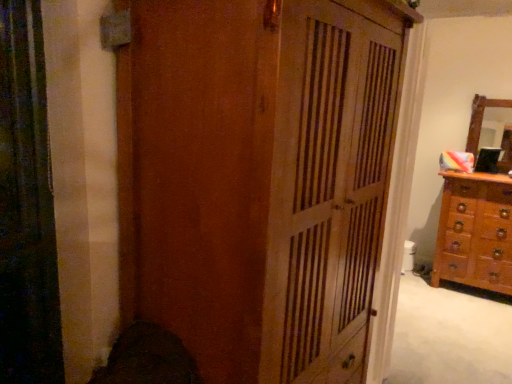
Question: Is wooden mirror at right next to wooden cupboard at center?

Choices:
 (A) yes
 (B) no

Answer: (B)

Question: From the image's perspective, is wooden mirror at right below wooden cupboard at center?

Choices:
 (A) yes
 (B) no

Answer: (B)

Question: Is wooden mirror at right smaller than wooden cupboard at center?

Choices:
 (A) no
 (B) yes

Answer: (B)

Question: Is wooden cupboard at center at the back of wooden mirror at right?

Choices:
 (A) yes
 (B) no

Answer: (B)

Question: Can you confirm if wooden mirror at right is wider than wooden cupboard at center?

Choices:
 (A) no
 (B) yes

Answer: (A)

Question: Is wooden cupboard at center spatially inside wooden chest of drawers at right, or outside of it?

Choices:
 (A) inside
 (B) outside

Answer: (B)

Question: Considering the positions of point (324, 274) and point (476, 251), is point (324, 274) closer or farther from the camera than point (476, 251)?

Choices:
 (A) closer
 (B) farther

Answer: (A)

Question: In the image, is wooden cupboard at center positioned in front of or behind wooden chest of drawers at right?

Choices:
 (A) front
 (B) behind

Answer: (A)

Question: Based on their sizes in the image, would you say wooden cupboard at center is bigger or smaller than wooden chest of drawers at right?

Choices:
 (A) small
 (B) big

Answer: (B)

Question: From a real-world perspective, is wooden cupboard at center physically located above or below wooden mirror at right?

Choices:
 (A) above
 (B) below

Answer: (B)

Question: From the image's perspective, relative to wooden mirror at right, is wooden cupboard at center above or below?

Choices:
 (A) above
 (B) below

Answer: (B)

Question: Considering the positions of wooden cupboard at center and wooden mirror at right in the image, is wooden cupboard at center wider or thinner than wooden mirror at right?

Choices:
 (A) wide
 (B) thin

Answer: (A)

Question: Visually, is wooden cupboard at center positioned to the left or to the right of wooden mirror at right?

Choices:
 (A) right
 (B) left

Answer: (B)

Question: Looking at the image, does wooden chest of drawers at right seem bigger or smaller compared to wooden cupboard at center?

Choices:
 (A) small
 (B) big

Answer: (A)

Question: From a real-world perspective, is wooden chest of drawers at right above or below wooden cupboard at center?

Choices:
 (A) above
 (B) below

Answer: (B)